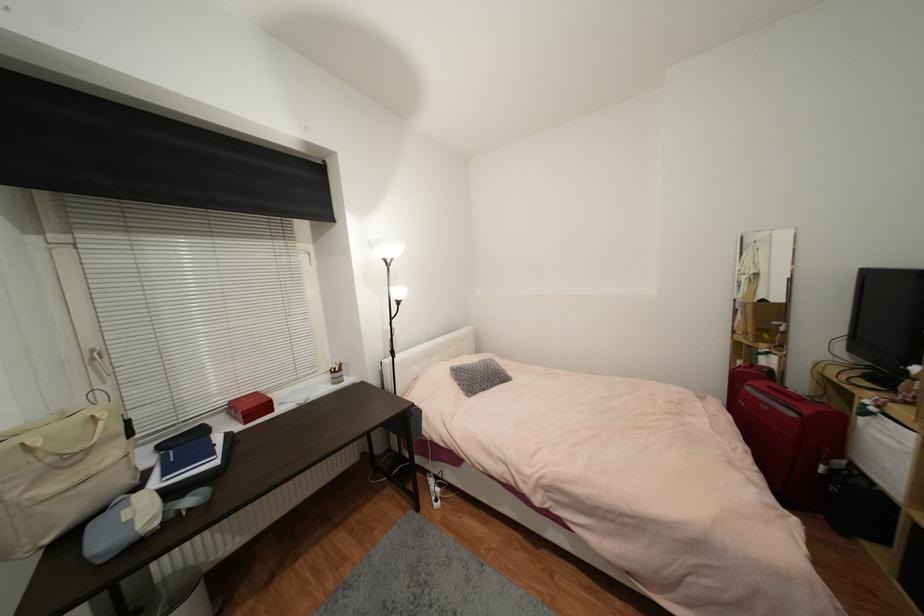
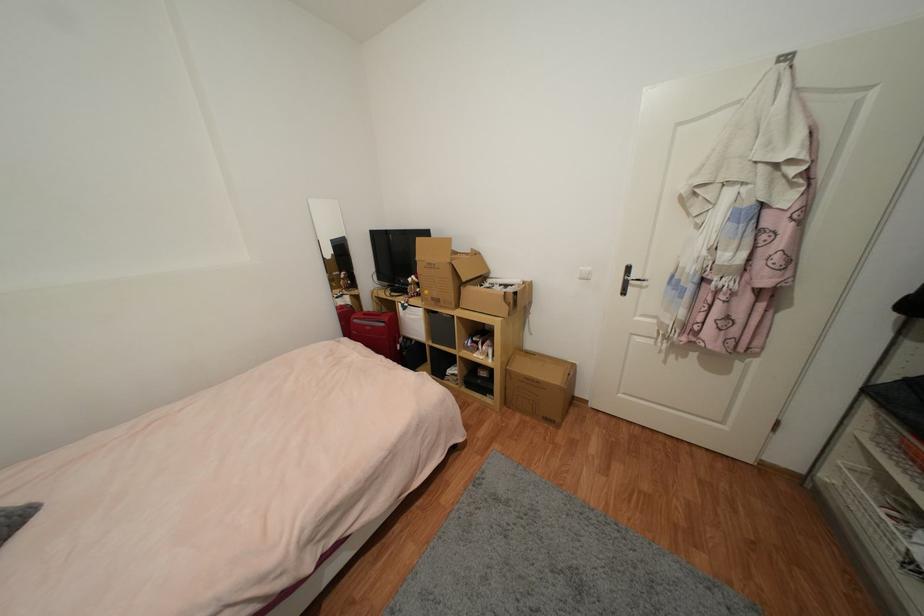
The images are taken continuously from a first-person perspective. In which direction is your viewpoint rotating?

The camera's rotation is toward right-down.